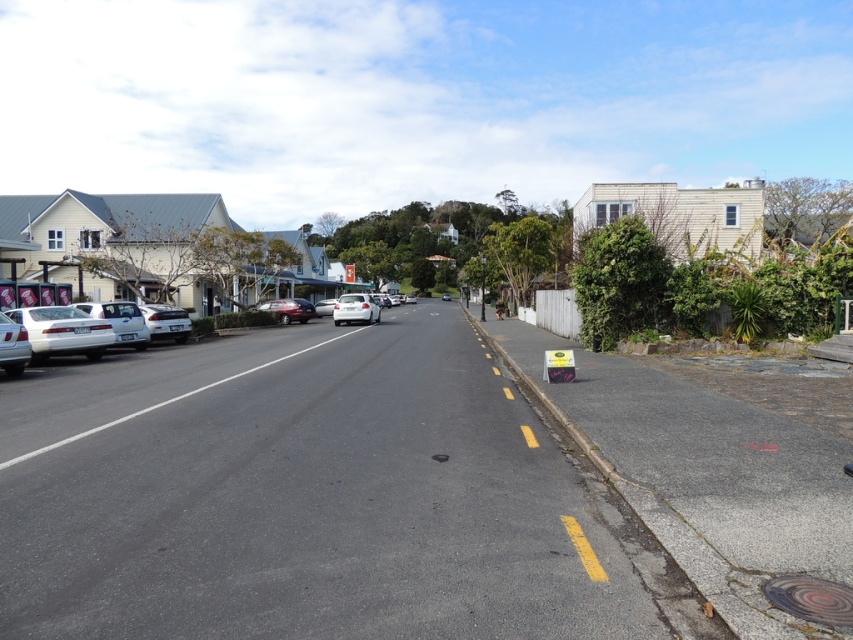
You are standing at the point indicated by the coordinates point (12, 346) in the image. What object is directly in front of you?

The point (12, 346) indicates a silver metallic car at left, so the silver metallic car at left is directly in front of you.

You are a pedestrian standing on the sidewalk on the right side of the street. You want to cross the street to reach the houses on the left. The silver metallic car at left and the satin white sedan at center are parked along the curb. Which car should you cross in front of to get closer to the houses?

You should cross in front of the silver metallic car at left because it is closer to you than the satin white sedan at center, as the silver metallic car at left is positioned to the left of the satin white sedan at center.

You are a delivery person driving a truck that is 2 meters wide. You need to pass between the silver metallic car at left and the satin white sedan at center parked on the street. Can your truck fit through the space between them?

The silver metallic car at left is thinner than the satin white sedan at center. Since the truck is 2 meters wide, the space between them may be sufficient if the combined width of the cars allows. However, without exact measurements, it is uncertain. Please check the actual space before proceeding.